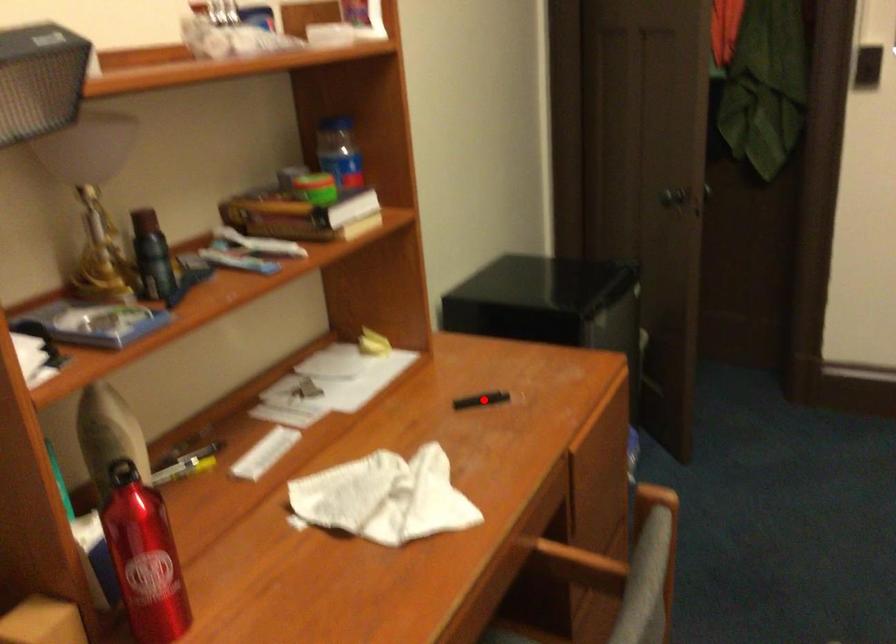
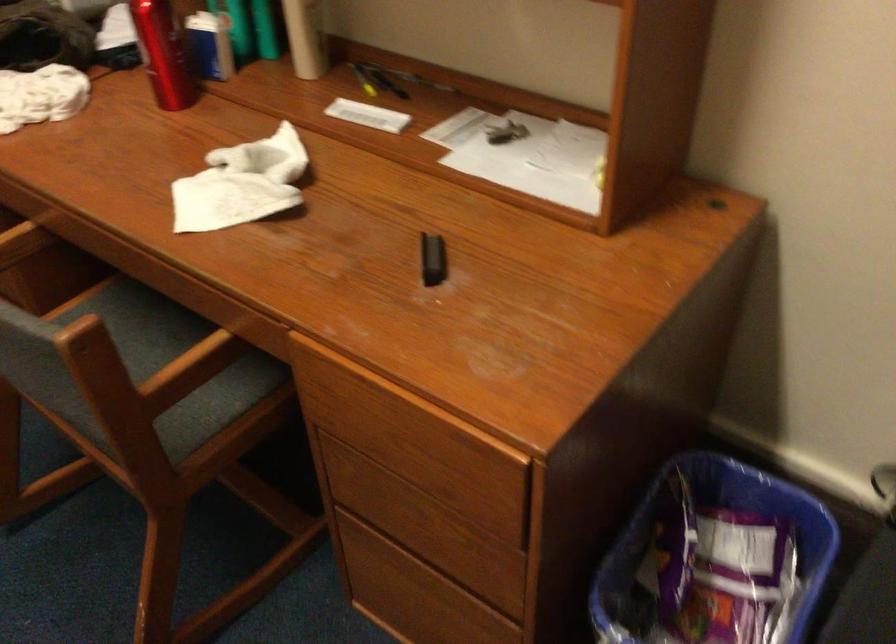
In the second image, find the point that corresponds to the highlighted location in the first image.

(433, 259)